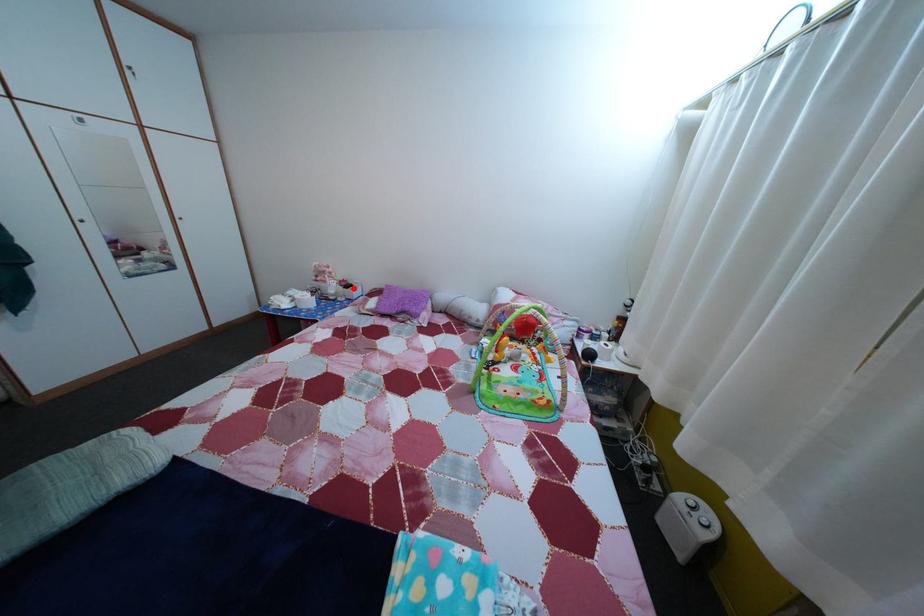
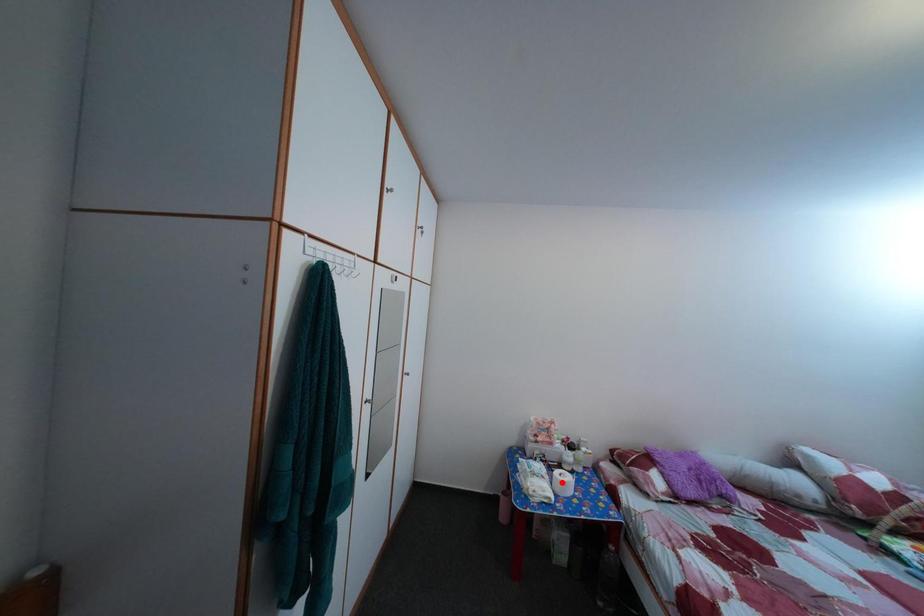
I am providing you with two images of the same scene from different viewpoints. A red point is marked on the first image and another point is marked on the second image. Is the marked point in image1 the same physical position as the marked point in image2?

No